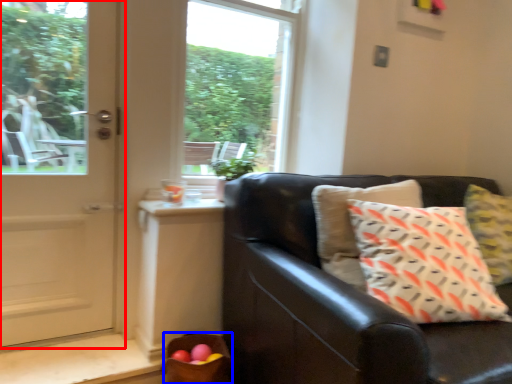
Question: Which object appears closest to the camera in this image, door (highlighted by a red box) or basket (highlighted by a blue box)?

Choices:
 (A) door
 (B) basket

Answer: (A)